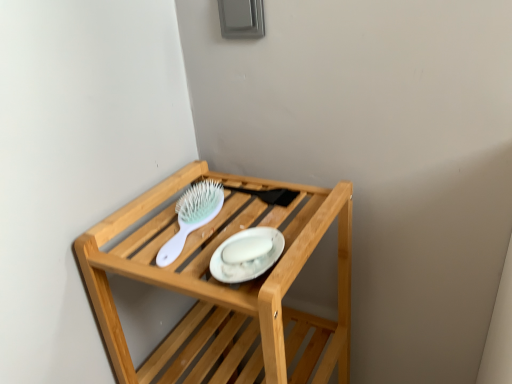
Where is `vacant space to the left of white plastic brush at upper center`? Image resolution: width=512 pixels, height=384 pixels. vacant space to the left of white plastic brush at upper center is located at coordinates (126, 235).